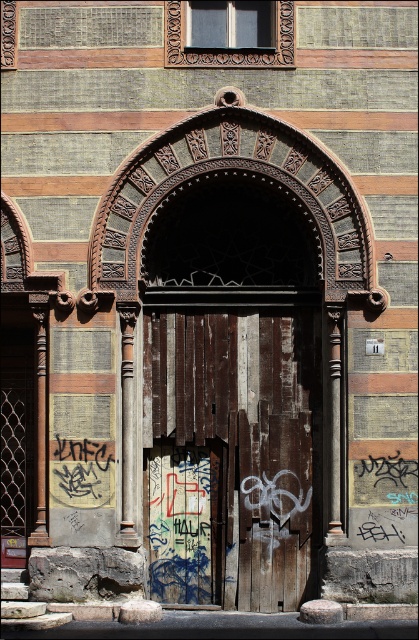
Question: Is weathered wood door at center to the right of grungy wooden door at center from the viewer's perspective?

Choices:
 (A) no
 (B) yes

Answer: (B)

Question: Is weathered wood door at center closer to the viewer compared to grungy wooden door at center?

Choices:
 (A) yes
 (B) no

Answer: (B)

Question: Is weathered wood door at center wider than grungy wooden door at center?

Choices:
 (A) no
 (B) yes

Answer: (A)

Question: Which point is farther to the camera?

Choices:
 (A) weathered wood door at center
 (B) grungy wooden door at center

Answer: (A)

Question: Among these objects, which one is farthest from the camera?

Choices:
 (A) weathered wood door at center
 (B) grungy wooden door at center

Answer: (A)

Question: Which point is closer to the camera?

Choices:
 (A) weathered wood door at center
 (B) grungy wooden door at center

Answer: (B)